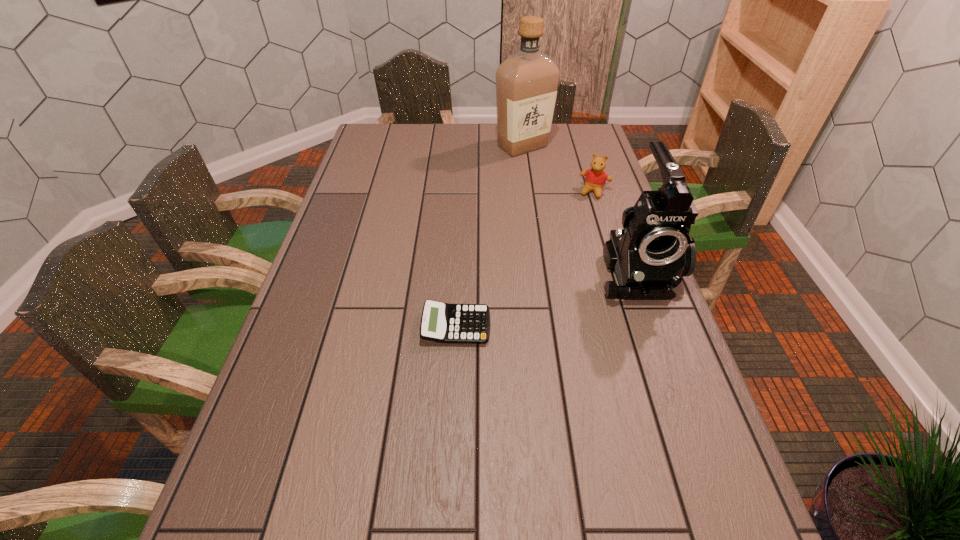
Locate an element on the screen. Image resolution: width=960 pixels, height=540 pixels. vacant space at the left edge of the desktop is located at coordinates (339, 199).

This screenshot has width=960, height=540. In the image, there is a desktop. What are the coordinates of `vacant region at the right edge` in the screenshot? It's located at (639, 319).

Where is `vacant position at the far left corner of the desktop`? The image size is (960, 540). vacant position at the far left corner of the desktop is located at coordinates [369, 129].

In the image, there is a desktop. Where is `vacant space at the far right corner`? Image resolution: width=960 pixels, height=540 pixels. vacant space at the far right corner is located at coordinates (557, 123).

Where is `vacant point located between the third object from right to left and the second nearest object`? The height and width of the screenshot is (540, 960). vacant point located between the third object from right to left and the second nearest object is located at coordinates tap(580, 208).

Where is `empty space between the calculator and the camcorder`? empty space between the calculator and the camcorder is located at coordinates (546, 298).

The image size is (960, 540). Find the location of `vacant area that lies between the shortest object and the third farthest object`. vacant area that lies between the shortest object and the third farthest object is located at coordinates (546, 298).

Identify the location of vacant space in between the calculator and the second tallest object. (546, 298).

Where is `vacant point located between the camcorder and the farthest object`? This screenshot has height=540, width=960. vacant point located between the camcorder and the farthest object is located at coordinates (580, 208).

You are a GUI agent. You are given a task and a screenshot of the screen. Output one action in this format:
    pyautogui.click(x=<x>, y=<y>)
    Task: Click on the free space between the calculator and the second object from left to right
    This screenshot has width=960, height=540.
    Given the screenshot: What is the action you would take?
    pyautogui.click(x=490, y=237)